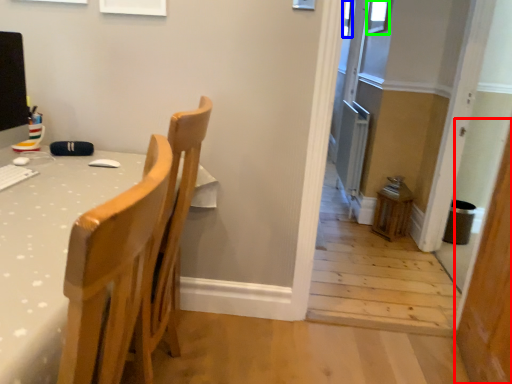
Question: Which object is positioned closest to screen door (highlighted by a red box)? Select from window (highlighted by a blue box) and window (highlighted by a green box).

Choices:
 (A) window
 (B) window

Answer: (A)